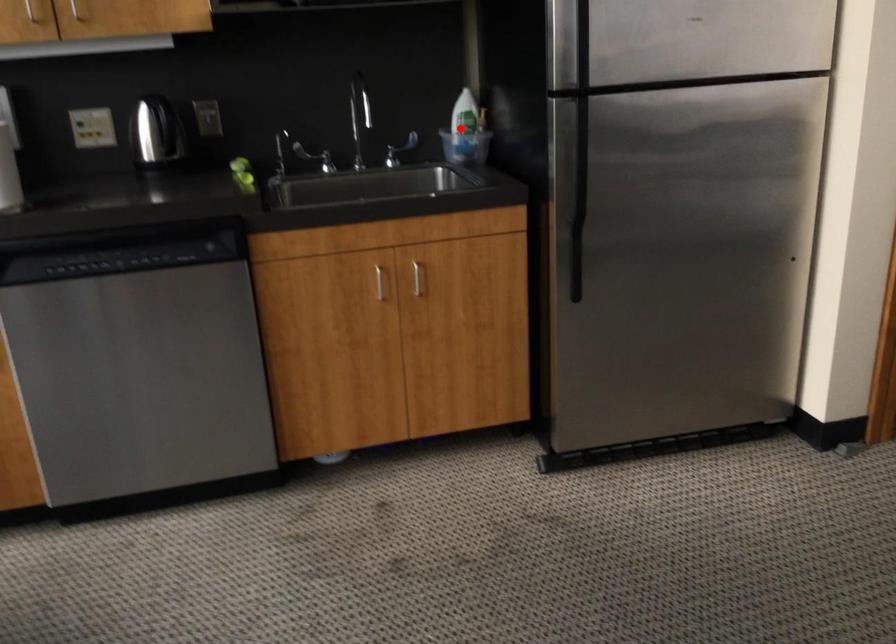
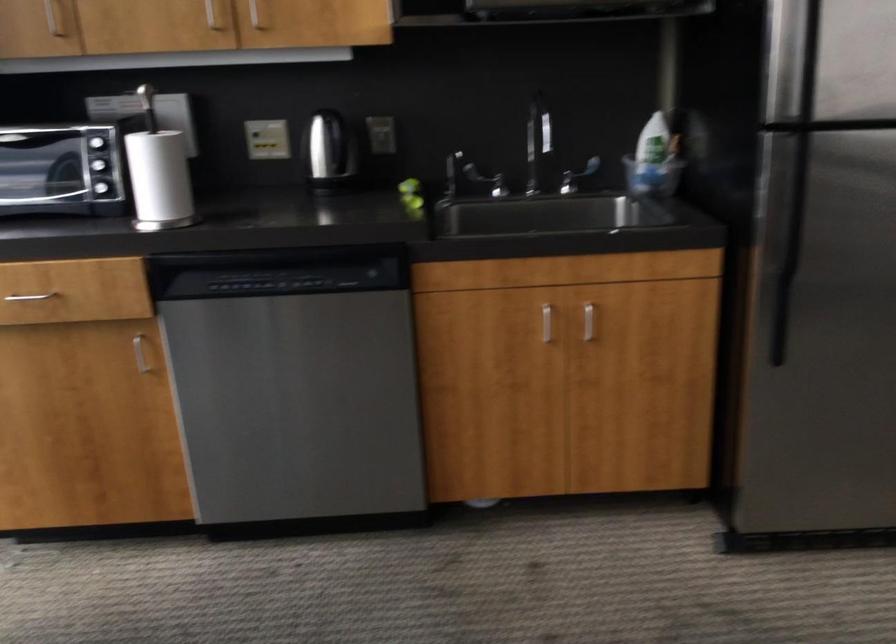
Question: I am providing you with two images of the same scene from different viewpoints. A red point is shown in image1. For the corresponding object point in image2, is it positioned nearer or farther from the camera?

Choices:
 (A) Nearer
 (B) Farther

Answer: (A)